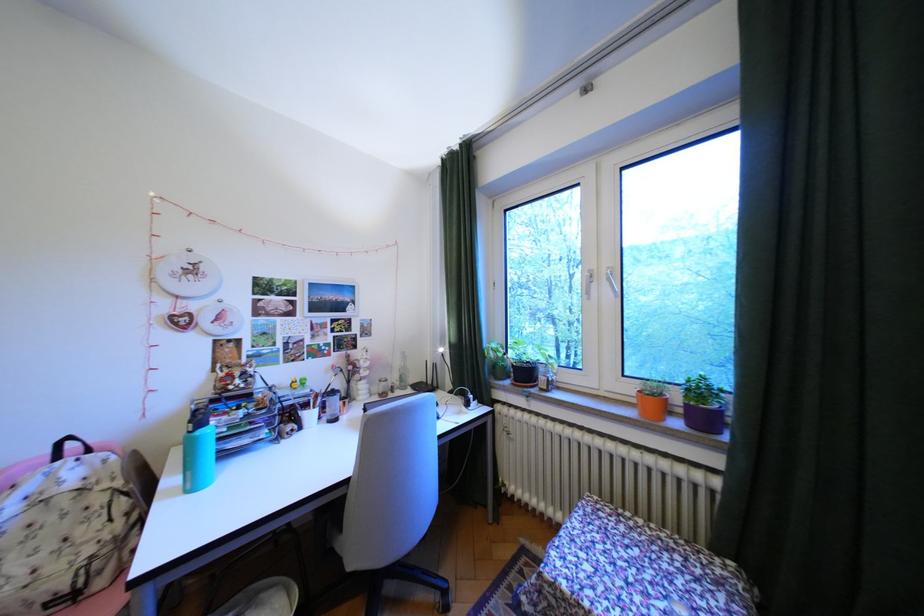
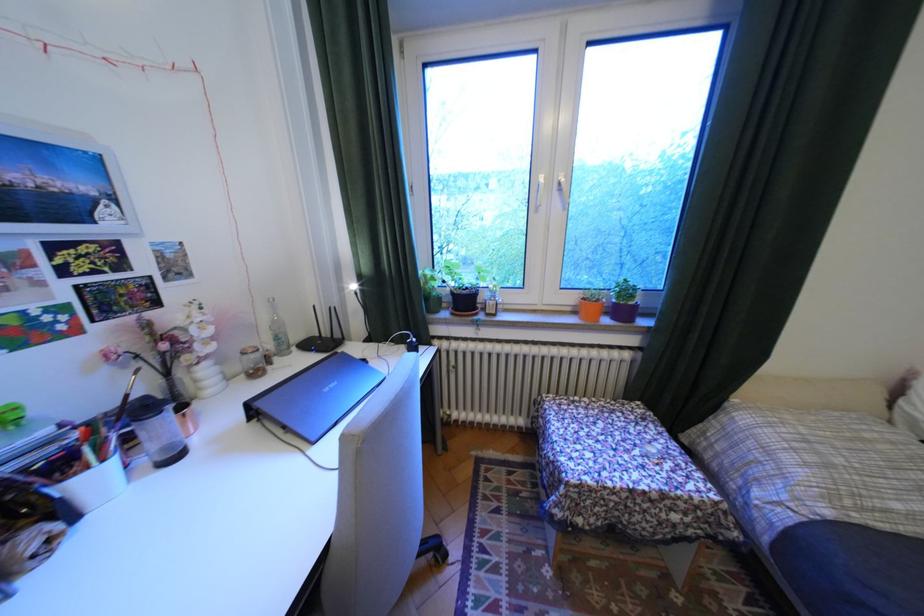
Where in the second image is the point corresponding to (x=392, y=381) from the first image?

(254, 354)